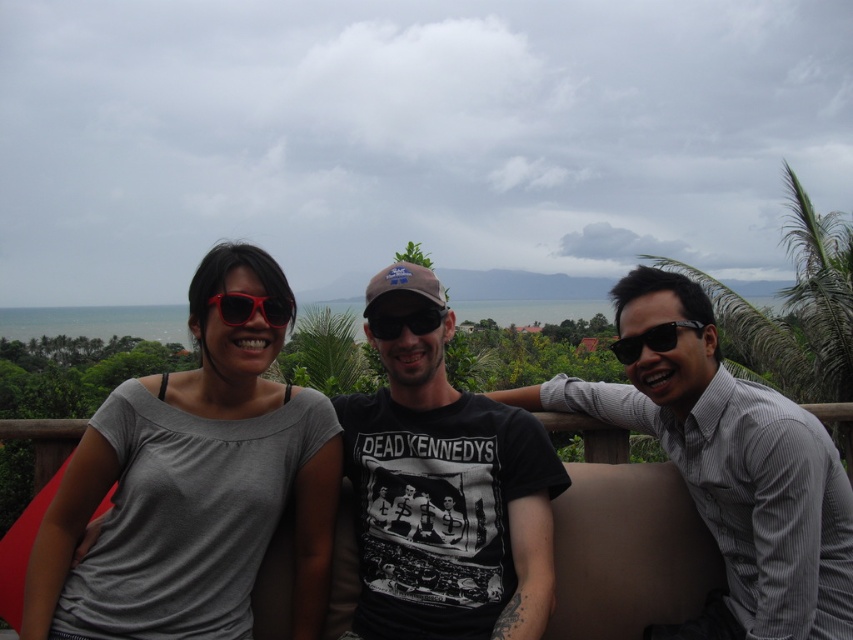
You are a photographer taking a portrait of the matte black sunglasses at left and the black plastic sunglasses at right. Which pair of sunglasses has a greater height?

The black plastic sunglasses at right is taller than the matte black sunglasses at left, so the black plastic sunglasses at right has a greater height.

You are a photographer taking a picture of the gray matte shirt at center and the black plastic sunglasses at right. Based on their positions, which object will appear closer to the camera in the final photo?

The gray matte shirt at center will appear closer to the camera in the final photo because it is positioned in front of the black plastic sunglasses at right.

You are a photographer trying to capture a candid shot of the gray matte shirt at center and the black plastic sunglasses at right. From the photographer perspective, which object is located more to the left?

The gray matte shirt at center is positioned on the left side of black plastic sunglasses at right, so the gray matte shirt at center is more to the left.